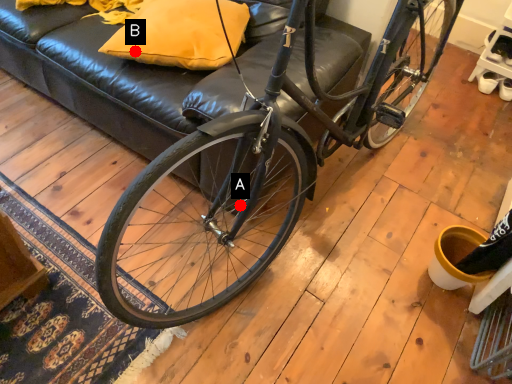
Question: Two points are circled on the image, labeled by A and B beside each circle. Which point is closer to the camera?

Choices:
 (A) A is closer
 (B) B is closer

Answer: (A)